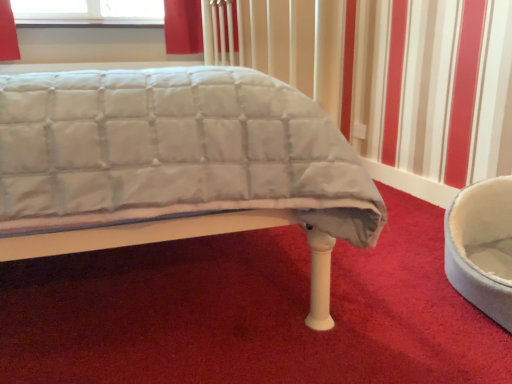
You are a GUI agent. You are given a task and a screenshot of the screen. Output one action in this format:
    pyautogui.click(x=<x>, y=<y>)
    Task: Click on the free point to the left of white plush bean bag at right
    This screenshot has height=384, width=512.
    Given the screenshot: What is the action you would take?
    pyautogui.click(x=362, y=309)